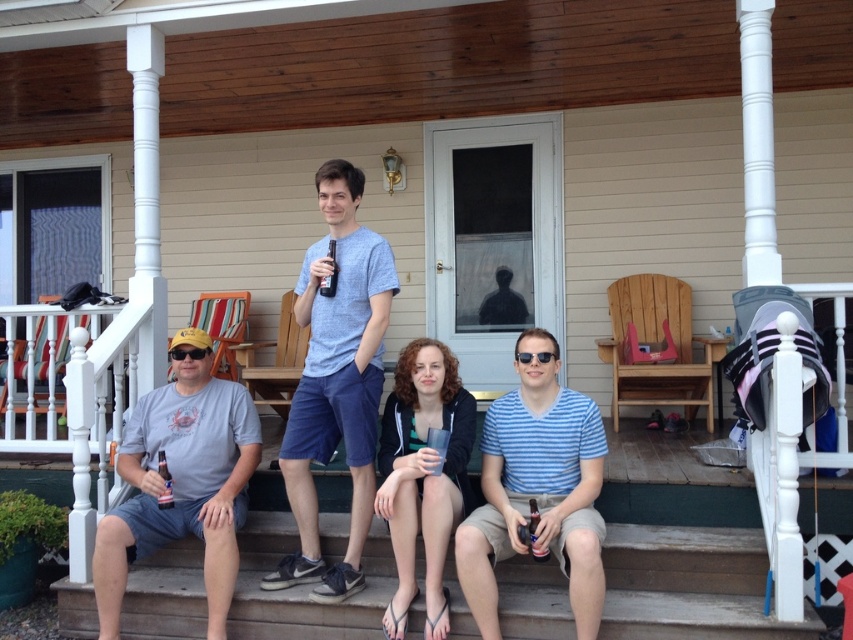
Looking at this image, is metallic silver can at lower center positioned behind brown glass bottle at center?

No, it is not.

Is metallic silver can at lower center positioned in front of brown glass bottle at center?

Yes, metallic silver can at lower center is in front of brown glass bottle at center.

Is point (531, 529) positioned in front of point (335, 289)?

Yes, point (531, 529) is in front of point (335, 289).

At what (x,y) coordinates should I click in order to perform the action: click on metallic silver can at lower center. Please return your answer as a coordinate pair (x, y). The image size is (853, 640). Looking at the image, I should click on (534, 532).

Find the location of a particular element. This screenshot has height=640, width=853. gray cotton t-shirt at left is located at coordinates (181, 481).

Does gray cotton t-shirt at left appear on the right side of translucent plastic bottle at lower left?

Correct, you'll find gray cotton t-shirt at left to the right of translucent plastic bottle at lower left.

Does point (212, 634) come closer to viewer compared to point (171, 490)?

Yes, it is.

The image size is (853, 640). I want to click on gray cotton t-shirt at left, so click(x=181, y=481).

Is metallic silver can at lower center to the right of translucent plastic bottle at lower left from the viewer's perspective?

Indeed, metallic silver can at lower center is positioned on the right side of translucent plastic bottle at lower left.

Is metallic silver can at lower center smaller than translucent plastic bottle at lower left?

Correct, metallic silver can at lower center occupies less space than translucent plastic bottle at lower left.

Is point (529, 529) more distant than point (165, 477)?

No, (529, 529) is in front of (165, 477).

Where is `metallic silver can at lower center`? The height and width of the screenshot is (640, 853). metallic silver can at lower center is located at coordinates (534, 532).